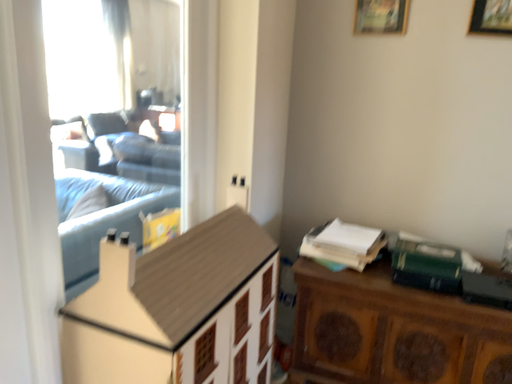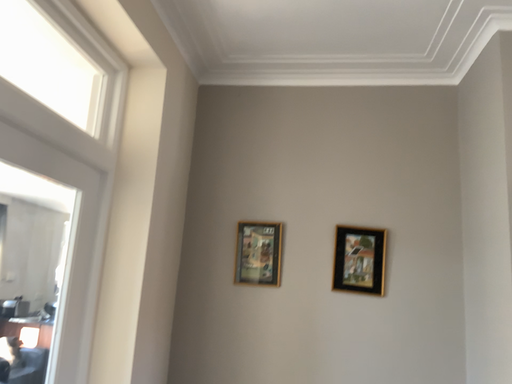
Question: How did the camera likely rotate when shooting the video?

Choices:
 (A) rotated downward
 (B) rotated upward

Answer: (B)